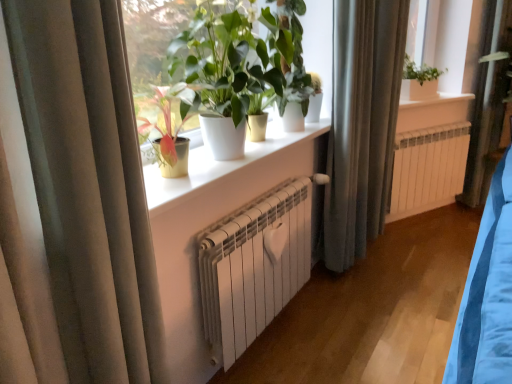
Question: Would you say white matte radiator at center is to the left or to the right of white ceramic window sill at upper center, the first window sill positioned from the top, in the picture?

Choices:
 (A) right
 (B) left

Answer: (B)

Question: From the image's perspective, is white matte radiator at center above or below white ceramic window sill at upper center, which is counted as the 1th window sill, starting from the right?

Choices:
 (A) above
 (B) below

Answer: (B)

Question: Based on their relative distances, which object is nearer to the beige fabric curtain at left, placed as the 1th curtain when sorted from left to right?

Choices:
 (A) green glossy plant at center, which is counted as the second houseplant, starting from the front
 (B) silky gray curtain at center, the first curtain in the right-to-left sequence
 (C) white metallic radiator at center
 (D) white glossy window sill at center, the 2th window sill viewed from the right
 (E) white ceramic window sill at upper center, the first window sill from the back

Answer: (D)

Question: Estimate the real-world distances between objects in this image. Which object is farther from the beige fabric curtain at left, placed as the 1th curtain when sorted from front to back?

Choices:
 (A) white ceramic window sill at upper center, which is counted as the 1th window sill, starting from the right
 (B) white glossy pot at center, the 1th houseplant positioned from the front
 (C) white matte radiator at center
 (D) white metallic radiator at center
 (E) white glossy window sill at center, which is the first window sill in bottom-to-top order

Answer: (A)